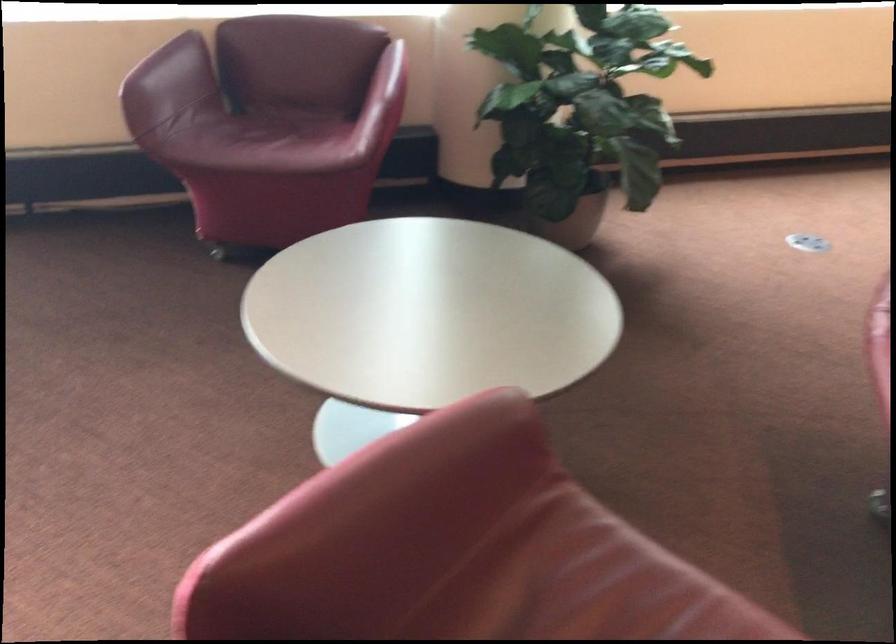
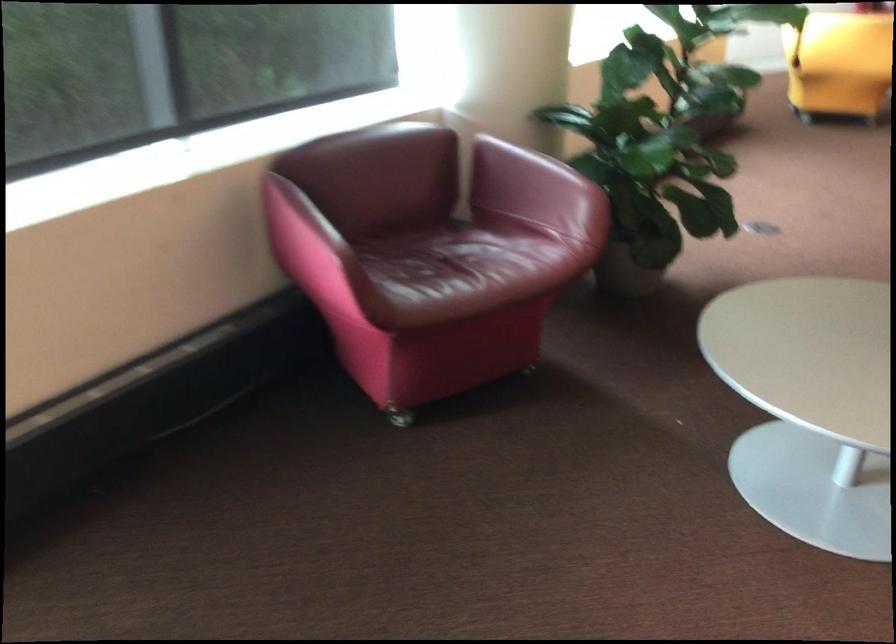
Find the pixel in the second image that matches [326,98] in the first image.

(426, 212)